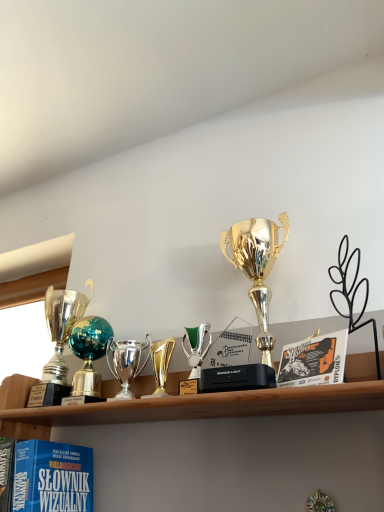
The width and height of the screenshot is (384, 512). What do you see at coordinates (161, 365) in the screenshot?
I see `gold shiny trophy at center, the third trophy when ordered from left to right` at bounding box center [161, 365].

The image size is (384, 512). What do you see at coordinates (89, 353) in the screenshot? I see `shiny silver trophy at left, the 4th trophy from the right` at bounding box center [89, 353].

The image size is (384, 512). Describe the element at coordinates (26, 322) in the screenshot. I see `metallic trophy at left` at that location.

What do you see at coordinates (125, 362) in the screenshot? I see `polished silver trophy at center, placed as the second trophy when sorted from left to right` at bounding box center [125, 362].

In the scene shown: Measure the distance between polished silver trophy at center, acting as the 3th trophy starting from the right, and camera.

A distance of 34.53 inches exists between polished silver trophy at center, acting as the 3th trophy starting from the right, and camera.

The image size is (384, 512). I want to click on gold shiny trophy at center, which is counted as the 1th trophy, starting from the right, so click(257, 266).

Image resolution: width=384 pixels, height=512 pixels. Find the location of `gold shiny trophy at center, the third trophy when ordered from left to right`. gold shiny trophy at center, the third trophy when ordered from left to right is located at coordinates (161, 365).

Considering the sizes of objects gold shiny trophy at center, placed as the 2th trophy when sorted from right to left, and polished silver trophy at center, acting as the 3th trophy starting from the right, in the image provided, who is taller, gold shiny trophy at center, placed as the 2th trophy when sorted from right to left, or polished silver trophy at center, acting as the 3th trophy starting from the right,?

Standing taller between the two is polished silver trophy at center, acting as the 3th trophy starting from the right.

Is gold shiny trophy at center, placed as the 2th trophy when sorted from right to left, turned away from polished silver trophy at center, acting as the 3th trophy starting from the right?

No, gold shiny trophy at center, placed as the 2th trophy when sorted from right to left, is not facing the opposite direction of polished silver trophy at center, acting as the 3th trophy starting from the right.

From a real-world perspective, is gold shiny trophy at center, the third trophy when ordered from left to right, under polished silver trophy at center, placed as the second trophy when sorted from left to right?

Yes, from a real-world perspective, gold shiny trophy at center, the third trophy when ordered from left to right, is below polished silver trophy at center, placed as the second trophy when sorted from left to right.

Is point (164, 383) farther from camera compared to point (110, 340)?

That is False.

Between polished silver trophy at center, placed as the second trophy when sorted from left to right, and gold shiny trophy at center, the third trophy when ordered from left to right, which one appears on the left side from the viewer's perspective?

Positioned to the left is polished silver trophy at center, placed as the second trophy when sorted from left to right.

From the image's perspective, is polished silver trophy at center, acting as the 3th trophy starting from the right, above or below gold shiny trophy at center, placed as the 2th trophy when sorted from right to left?

Based on their image positions, polished silver trophy at center, acting as the 3th trophy starting from the right, is located beneath gold shiny trophy at center, placed as the 2th trophy when sorted from right to left.

From the gold shiny trophy at center, the third trophy when ordered from left to right, count the 1st trophy to the left and point to it. Please provide its 2D coordinates.

[(125, 362)]

Considering the relative sizes of polished silver trophy at center, placed as the second trophy when sorted from left to right, and gold shiny trophy at center, placed as the 2th trophy when sorted from right to left, in the image provided, is polished silver trophy at center, placed as the second trophy when sorted from left to right, bigger than gold shiny trophy at center, placed as the 2th trophy when sorted from right to left,?

Correct, polished silver trophy at center, placed as the second trophy when sorted from left to right, is larger in size than gold shiny trophy at center, placed as the 2th trophy when sorted from right to left.

Who is taller, metallic trophy at left or gold shiny trophy at center, the third trophy when ordered from left to right?

metallic trophy at left is taller.

Is metallic trophy at left aimed at gold shiny trophy at center, the third trophy when ordered from left to right?

No, metallic trophy at left does not turn towards gold shiny trophy at center, the third trophy when ordered from left to right.

Is metallic trophy at left in contact with gold shiny trophy at center, the third trophy when ordered from left to right?

metallic trophy at left and gold shiny trophy at center, the third trophy when ordered from left to right, are clearly separated.

From the image's perspective, starting from the metallic trophy at left, which trophy is the 2nd one below? Please provide its 2D coordinates.

[(161, 365)]

Is gold shiny trophy at center, which is counted as the 1th trophy, starting from the right, at the back of gold shiny trophy at center, the third trophy when ordered from left to right?

No, gold shiny trophy at center, the third trophy when ordered from left to right, is not facing the opposite direction of gold shiny trophy at center, which is counted as the 1th trophy, starting from the right.

Which is more to the left, gold shiny trophy at center, placed as the 2th trophy when sorted from right to left, or gold shiny trophy at center, marked as the 4th trophy in a left-to-right arrangement?

From the viewer's perspective, gold shiny trophy at center, placed as the 2th trophy when sorted from right to left, appears more on the left side.

Can you confirm if gold shiny trophy at center, the third trophy when ordered from left to right, is wider than gold shiny trophy at center, marked as the 4th trophy in a left-to-right arrangement?

In fact, gold shiny trophy at center, the third trophy when ordered from left to right, might be narrower than gold shiny trophy at center, marked as the 4th trophy in a left-to-right arrangement.

Based on the photo, in terms of size, does gold shiny trophy at center, the third trophy when ordered from left to right, appear bigger or smaller than gold shiny trophy at center, marked as the 4th trophy in a left-to-right arrangement?

In the image, gold shiny trophy at center, the third trophy when ordered from left to right, appears to be smaller than gold shiny trophy at center, marked as the 4th trophy in a left-to-right arrangement.

Is metallic trophy at left positioned far away from polished silver trophy at center, acting as the 3th trophy starting from the right?

metallic trophy at left is actually quite close to polished silver trophy at center, acting as the 3th trophy starting from the right.

Is metallic trophy at left oriented towards polished silver trophy at center, acting as the 3th trophy starting from the right?

No, metallic trophy at left is not facing towards polished silver trophy at center, acting as the 3th trophy starting from the right.

Which point is more distant from viewer, (62, 278) or (124, 395)?

Point (62, 278)

Is shiny silver trophy at left, the 1th trophy positioned from the left, turned away from metallic trophy at left?

No, shiny silver trophy at left, the 1th trophy positioned from the left, is not facing away from metallic trophy at left.

This screenshot has height=512, width=384. What are the coordinates of `window screen on the left of shiny silver trophy at left, the 4th trophy from the right` in the screenshot? It's located at (26, 322).

From a real-world perspective, is shiny silver trophy at left, the 1th trophy positioned from the left, physically above metallic trophy at left?

Incorrect, from a real-world perspective, shiny silver trophy at left, the 1th trophy positioned from the left, is lower than metallic trophy at left.

Which of these two, shiny silver trophy at left, the 4th trophy from the right, or metallic trophy at left, is thinner?

Thinner between the two is shiny silver trophy at left, the 4th trophy from the right.

Looking at this image, is polished silver trophy at center, placed as the second trophy when sorted from left to right, looking in the opposite direction of shiny silver trophy at left, the 4th trophy from the right?

polished silver trophy at center, placed as the second trophy when sorted from left to right, is not turned away from shiny silver trophy at left, the 4th trophy from the right.

Is polished silver trophy at center, placed as the second trophy when sorted from left to right, closer to the viewer compared to shiny silver trophy at left, the 4th trophy from the right?

Yes.

In the scene shown: Is polished silver trophy at center, placed as the second trophy when sorted from left to right, surrounding shiny silver trophy at left, the 1th trophy positioned from the left?

No, shiny silver trophy at left, the 1th trophy positioned from the left, is not a part of polished silver trophy at center, placed as the second trophy when sorted from left to right.

Between point (123, 356) and point (104, 349), which one is positioned in front?

Positioned in front is point (123, 356).

You are a GUI agent. You are given a task and a screenshot of the screen. Output one action in this format:
    pyautogui.click(x=<x>, y=<y>)
    Task: Click on the trophy below the polished silver trophy at center, placed as the second trophy when sorted from left to right (from a real-world perspective)
    The width and height of the screenshot is (384, 512).
    Given the screenshot: What is the action you would take?
    pyautogui.click(x=161, y=365)

From a real-world perspective, count 1st trophys upward from the gold shiny trophy at center, placed as the 2th trophy when sorted from right to left, and point to it. Please provide its 2D coordinates.

[(125, 362)]

Based on their spatial positions, is metallic trophy at left or gold shiny trophy at center, the third trophy when ordered from left to right, closer to gold shiny trophy at center, marked as the 4th trophy in a left-to-right arrangement?

gold shiny trophy at center, the third trophy when ordered from left to right.

When comparing their distances from matte blue book at lower left, does gold shiny trophy at center, which is counted as the 1th trophy, starting from the right, or polished silver trophy at center, placed as the second trophy when sorted from left to right, seem further?

gold shiny trophy at center, which is counted as the 1th trophy, starting from the right, lies further to matte blue book at lower left than the other object.

When comparing their distances from polished silver trophy at center, placed as the second trophy when sorted from left to right, does shiny silver trophy at left, the 1th trophy positioned from the left, or matte blue book at lower left seem closer?

shiny silver trophy at left, the 1th trophy positioned from the left.

Which object lies further to the anchor point metallic trophy at left, shiny silver trophy at left, the 4th trophy from the right, or matte blue book at lower left?

Based on the image, matte blue book at lower left appears to be further to metallic trophy at left.

Based on the photo, considering their positions, is shiny silver trophy at left, the 1th trophy positioned from the left, positioned closer to gold shiny trophy at center, the third trophy when ordered from left to right, than matte blue book at lower left?

The object closer to gold shiny trophy at center, the third trophy when ordered from left to right, is shiny silver trophy at left, the 1th trophy positioned from the left.

When comparing their distances from gold shiny trophy at center, placed as the 2th trophy when sorted from right to left, does matte blue book at lower left or polished silver trophy at center, placed as the second trophy when sorted from left to right, seem closer?

polished silver trophy at center, placed as the second trophy when sorted from left to right.

Based on their spatial positions, is metallic trophy at left or matte blue book at lower left closer to polished silver trophy at center, placed as the second trophy when sorted from left to right?

matte blue book at lower left is positioned closer to the anchor polished silver trophy at center, placed as the second trophy when sorted from left to right.

From the image, which object appears to be nearer to matte blue book at lower left, metallic trophy at left or shiny silver trophy at left, the 4th trophy from the right?

Among the two, shiny silver trophy at left, the 4th trophy from the right, is located nearer to matte blue book at lower left.

Find the location of `trophy between polished silver trophy at center, acting as the 3th trophy starting from the right, and gold shiny trophy at center, which is counted as the 1th trophy, starting from the right`. trophy between polished silver trophy at center, acting as the 3th trophy starting from the right, and gold shiny trophy at center, which is counted as the 1th trophy, starting from the right is located at coordinates (161, 365).

Where is `book located between metallic trophy at left and gold shiny trophy at center, which is counted as the 1th trophy, starting from the right, in the left-right direction`? book located between metallic trophy at left and gold shiny trophy at center, which is counted as the 1th trophy, starting from the right, in the left-right direction is located at coordinates (52, 477).

This screenshot has width=384, height=512. Identify the location of trophy between metallic trophy at left and polished silver trophy at center, acting as the 3th trophy starting from the right, from left to right. 89,353.

At what (x,y) coordinates should I click in order to perform the action: click on book between metallic trophy at left and gold shiny trophy at center, placed as the 2th trophy when sorted from right to left, from left to right. Please return your answer as a coordinate pair (x, y). Looking at the image, I should click on (52, 477).